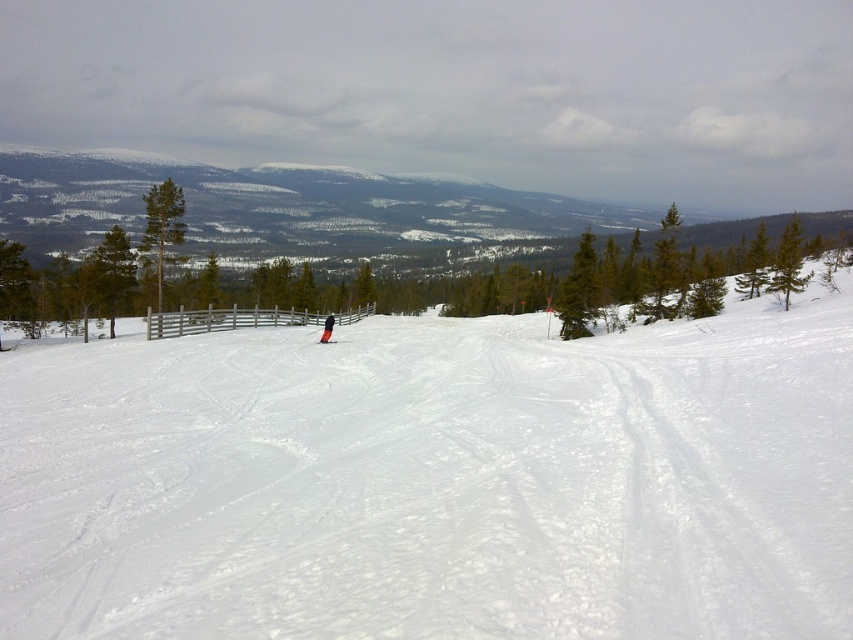
You are a photographer positioned at the camera location. You want to capture both the point at (x=457, y=428) and the point at (x=334, y=342) in your shot. Which point will appear larger in your photo?

Point (x=457, y=428) is closer to the camera than point (x=334, y=342), so it will appear larger in the photo.

You are a photographer planning to take a picture of the black fabric person at center and the white powdery snow at center. Which object will appear larger in the photo?

The white powdery snow at center will appear larger in the photo because it has a larger size compared to the black fabric person at center.

From the picture: You are a skier planning to carve a turn on the slope. Considering the white powdery snow at center and the orange fabric ski at center, which one has a bigger surface area?

The white powdery snow at center is larger in size than the orange fabric ski at center, so the white powdery snow at center has a bigger surface area.